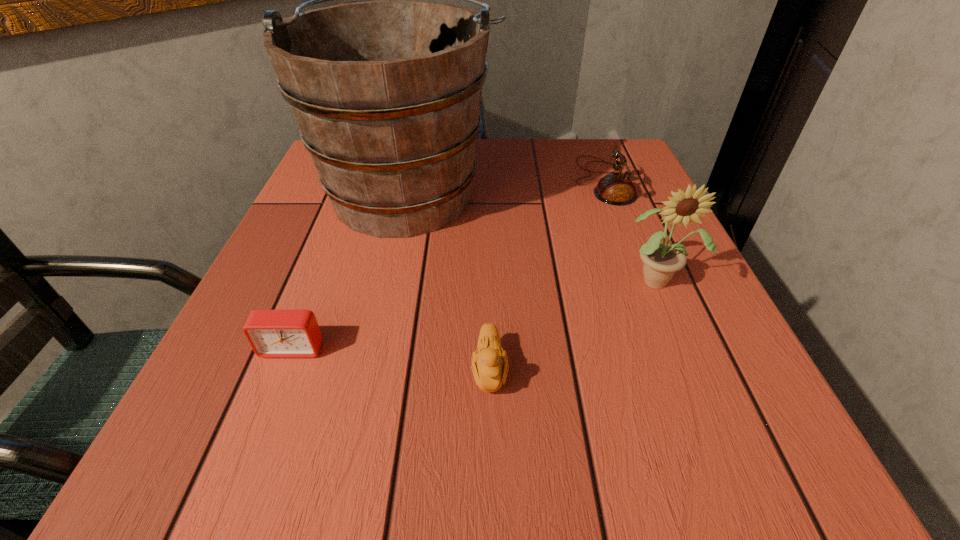
You are a GUI agent. You are given a task and a screenshot of the screen. Output one action in this format:
    pyautogui.click(x=<x>, y=<y>)
    Task: Click on the vacant area that lies between the alarm clock and the duckling
    The width and height of the screenshot is (960, 540).
    Given the screenshot: What is the action you would take?
    pyautogui.click(x=391, y=360)

Identify the location of vacant region between the bucket and the fourth shortest object. The height and width of the screenshot is (540, 960). (533, 235).

The width and height of the screenshot is (960, 540). In order to click on vacant region between the bucket and the telephone in this screenshot , I will do `click(505, 186)`.

The image size is (960, 540). I want to click on free spot between the duckling and the third farthest object, so click(x=574, y=325).

Where is `vacant space that is in between the telephone and the bucket`? vacant space that is in between the telephone and the bucket is located at coordinates (505, 186).

What are the coordinates of `free space between the sunflower and the duckling` in the screenshot? It's located at (574, 325).

Identify the location of unoccupied area between the telephone and the alarm clock. [447, 265].

Locate an element on the screen. Image resolution: width=960 pixels, height=540 pixels. object that is the closest to the duckling is located at coordinates (386, 94).

Select which object is the closest to the third farthest object. Please provide its 2D coordinates. Your answer should be formatted as a tuple, i.e. [(x, y)], where the tuple contains the x and y coordinates of a point satisfying the conditions above.

[(616, 188)]

Identify the location of vacant region that satisfies the following two spatial constraints: 1. on the rotary dial of the telephone; 2. on the front-facing side of the alarm clock. (667, 348).